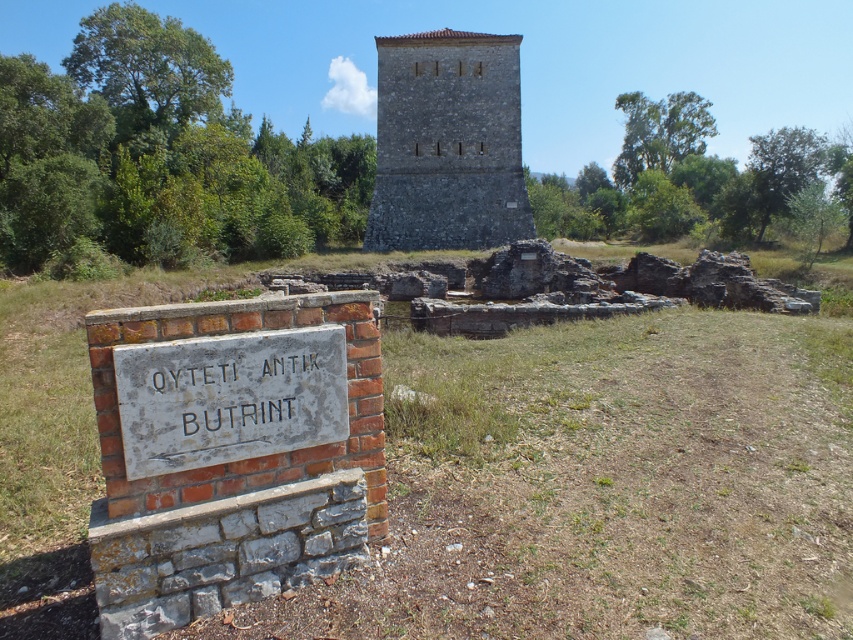
Question: Can you confirm if stone tower at center is positioned below white stone sign at lower left?

Choices:
 (A) no
 (B) yes

Answer: (A)

Question: Which object is positioned farthest from the brick sign at lower left?

Choices:
 (A) white stone sign at center
 (B) stone tower at center

Answer: (B)

Question: Which of the following is the closest to the observer?

Choices:
 (A) (218, 522)
 (B) (283, 369)
 (C) (386, 70)

Answer: (A)

Question: Estimate the real-world distances between objects in this image. Which object is closer to the stone tower at center?

Choices:
 (A) brick sign at lower left
 (B) white stone sign at center
 (C) white stone sign at lower left

Answer: (A)

Question: Can you confirm if brick sign at lower left is thinner than white stone sign at lower left?

Choices:
 (A) yes
 (B) no

Answer: (B)

Question: Can you confirm if white stone sign at lower left is positioned below white stone sign at center?

Choices:
 (A) no
 (B) yes

Answer: (A)